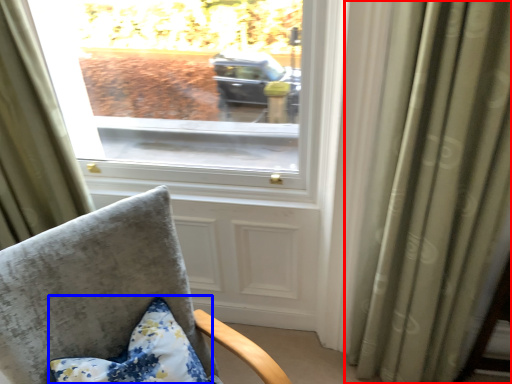
Question: Which of the following is the farthest to the observer, curtain (highlighted by a red box) or pillow (highlighted by a blue box)?

Choices:
 (A) curtain
 (B) pillow

Answer: (B)